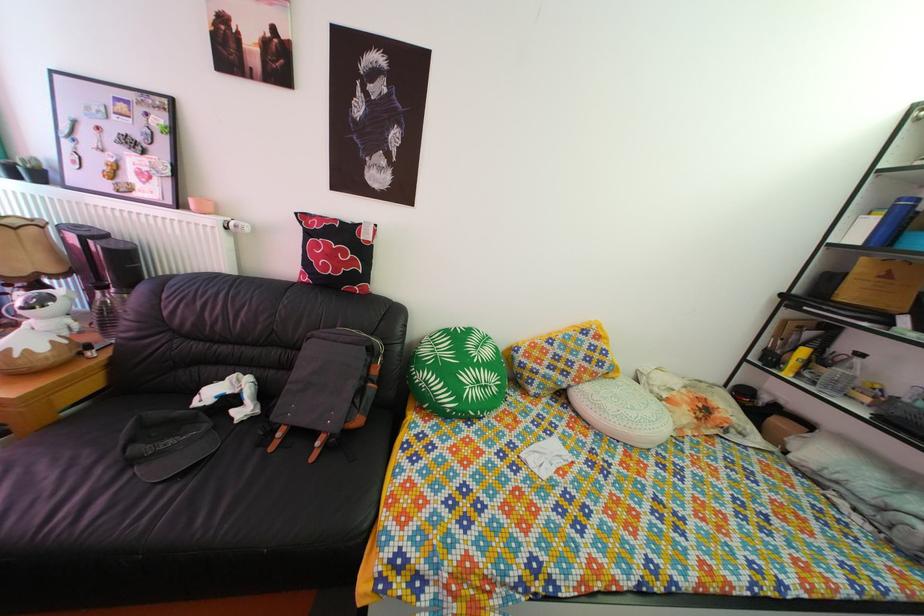
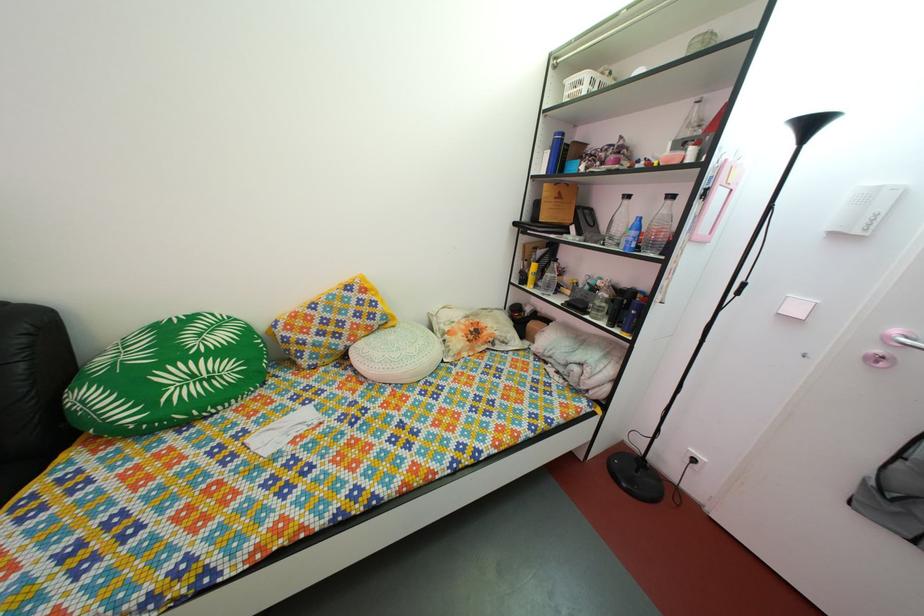
Find the pixel in the second image that matches point (573, 394) in the first image.

(349, 357)